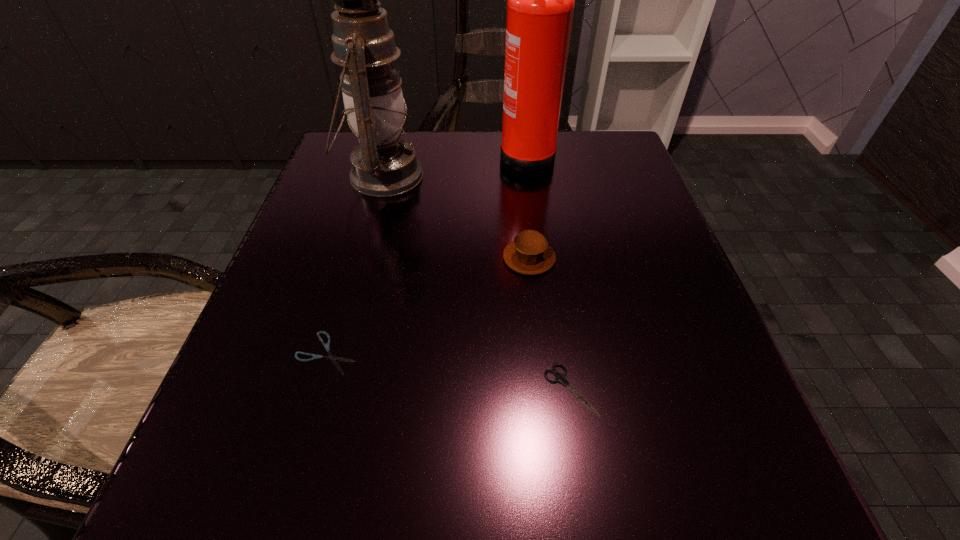
In order to click on blank region between the third nearest object and the oil lamp in this screenshot , I will do `click(456, 217)`.

Image resolution: width=960 pixels, height=540 pixels. Identify the location of empty location between the shorter shears and the third shortest object. (428, 306).

Image resolution: width=960 pixels, height=540 pixels. I want to click on blank region between the tallest object and the shorter shears, so tap(427, 254).

Identify the location of unoccupied area between the right shears and the tallest object. Image resolution: width=960 pixels, height=540 pixels. (548, 272).

You are a GUI agent. You are given a task and a screenshot of the screen. Output one action in this format:
    pyautogui.click(x=<x>, y=<y>)
    Task: Click on the free space between the second tallest object and the fire extinguisher
    This screenshot has height=540, width=960.
    Given the screenshot: What is the action you would take?
    pyautogui.click(x=454, y=166)

Image resolution: width=960 pixels, height=540 pixels. Identify the location of vacant space that is in between the muffin and the tallest object. (528, 207).

Find the location of a particular element. unoccupied area between the second shortest object and the shorter shears is located at coordinates (449, 371).

I want to click on object identified as the closest to the right shears, so click(529, 253).

Identify the location of object that is the second closest to the tallest object. The width and height of the screenshot is (960, 540). (529, 253).

The width and height of the screenshot is (960, 540). Find the location of `vacant space that satisfies the following two spatial constraints: 1. at the nozzle of the fire extinguisher; 2. on the front side of the oil lamp`. vacant space that satisfies the following two spatial constraints: 1. at the nozzle of the fire extinguisher; 2. on the front side of the oil lamp is located at coordinates (529, 176).